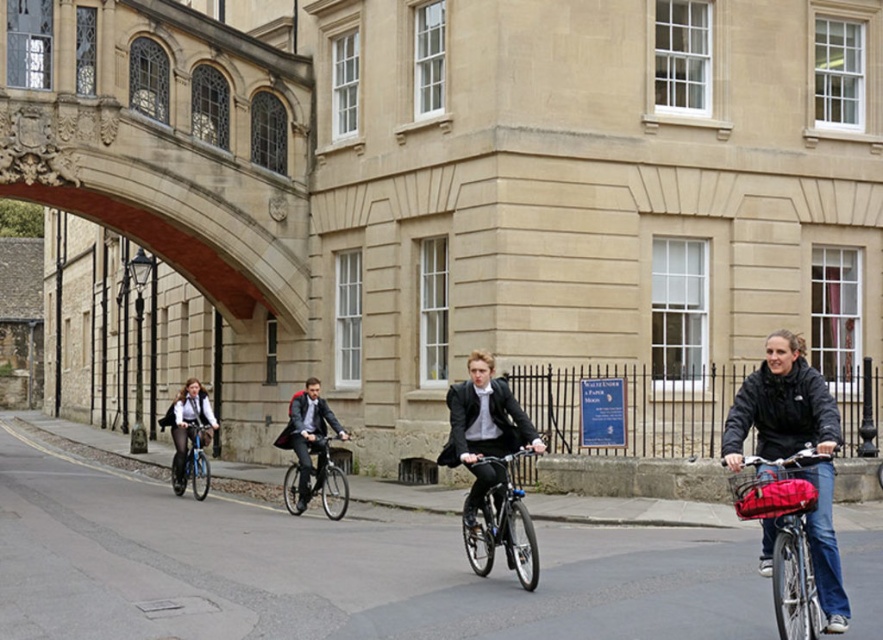
Measure the distance from matte black bicycle at right to shiny metallic bicycle at center.

9.44 meters

Is point (783, 529) in front of point (295, 467)?

That is True.

Identify the location of matte black bicycle at right. (785, 540).

Measure the distance between shiny blue bicycle at center and blue metallic bicycle at left.

shiny blue bicycle at center is 8.84 meters from blue metallic bicycle at left.

Who is positioned more to the left, shiny blue bicycle at center or blue metallic bicycle at left?

blue metallic bicycle at left is more to the left.

At what (x,y) coordinates should I click in order to perform the action: click on shiny blue bicycle at center. Please return your answer as a coordinate pair (x, y). The image size is (883, 640). Looking at the image, I should click on (x=502, y=524).

Which is in front, point (179, 452) or point (205, 472)?

Point (205, 472) is more forward.

Between point (182, 416) and point (185, 442), which one is positioned behind?

The point (182, 416) is behind.

Image resolution: width=883 pixels, height=640 pixels. What are the coordinates of `matte black jacket at left` in the screenshot? It's located at (187, 426).